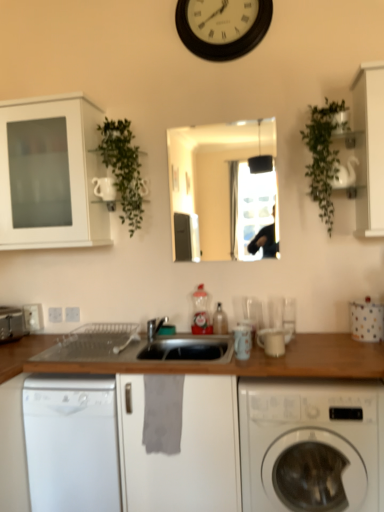
Question: From the image's perspective, relative to white matte clock at upper center, is white glossy washing machine at lower right above or below?

Choices:
 (A) below
 (B) above

Answer: (A)

Question: Would you say white glossy washing machine at lower right is inside or outside white matte clock at upper center?

Choices:
 (A) inside
 (B) outside

Answer: (B)

Question: Estimate the real-world distances between objects in this image. Which object is closer to the translucent plastic bottle at center, which is the 2th bottle from left to right?

Choices:
 (A) white matte clock at upper center
 (B) white ceramic mug at center, the third appliance when ordered from left to right
 (C) metallic silver toaster at left, the fourth appliance from the front
 (D) white glossy washing machine at lower right
 (E) white polka dot fabric at right, the 4th appliance when ordered from left to right

Answer: (B)

Question: Based on their relative distances, which object is nearer to the white plastic electric outlet at lower left, which is counted as the 3th electric outlet, starting from the right?

Choices:
 (A) white plastic electric outlet at lower left, which appears as the second electric outlet when viewed from the right
 (B) translucent plastic bottle at center, which is the first bottle from right to left
 (C) white ceramic mug at center, the second appliance positioned from the right
 (D) gray fabric at lower center
 (E) green leafy plant at upper right, acting as the second plant starting from the left

Answer: (A)